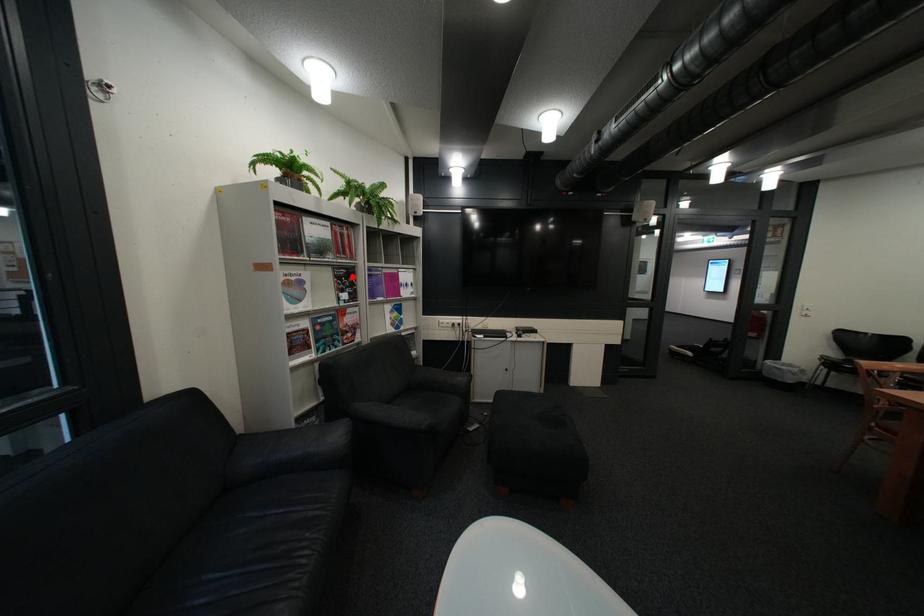
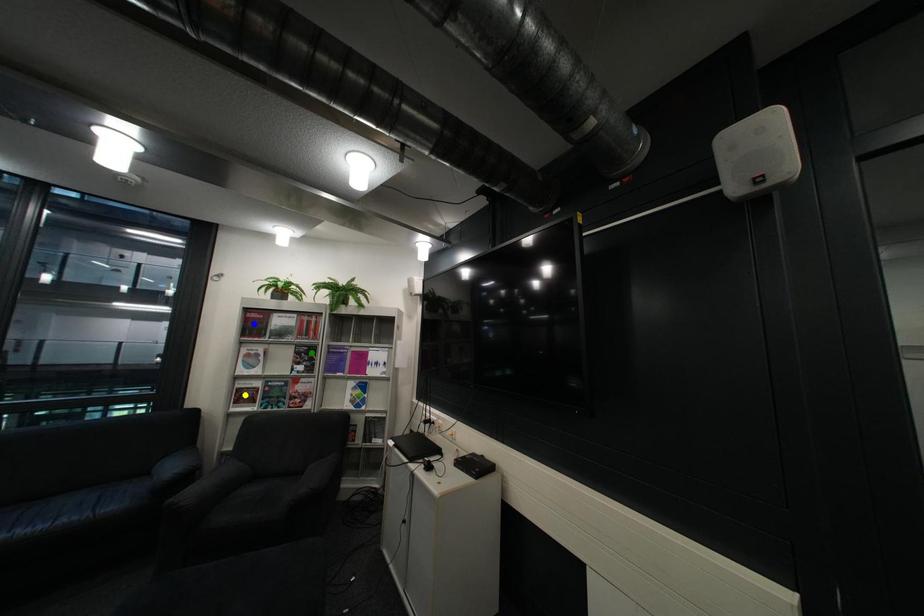
Question: I am providing you with two images of the same scene from different viewpoints. A red point is marked on the first image. You are given multiple points on the second image. Which point in image 2 is actually the same real-world point as the red point in image 1?

Choices:
 (A) green point
 (B) blue point
 (C) yellow point

Answer: (A)